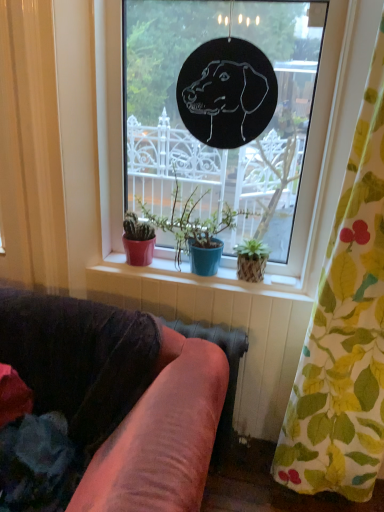
Question: Can you confirm if matte ceramic pots at center is shorter than floral fabric curtain at right?

Choices:
 (A) yes
 (B) no

Answer: (A)

Question: Is matte ceramic pots at center looking in the opposite direction of floral fabric curtain at right?

Choices:
 (A) no
 (B) yes

Answer: (A)

Question: Is matte ceramic pots at center completely or partially outside of floral fabric curtain at right?

Choices:
 (A) no
 (B) yes

Answer: (B)

Question: Considering the relative positions of matte ceramic pots at center and floral fabric curtain at right in the image provided, is matte ceramic pots at center to the right of floral fabric curtain at right from the viewer's perspective?

Choices:
 (A) no
 (B) yes

Answer: (A)

Question: Can you confirm if matte ceramic pots at center is taller than floral fabric curtain at right?

Choices:
 (A) no
 (B) yes

Answer: (A)

Question: Do you think matte ceramic pots at center is within black paper dog at center, or outside of it?

Choices:
 (A) outside
 (B) inside

Answer: (B)

Question: In terms of width, does matte ceramic pots at center look wider or thinner when compared to black paper dog at center?

Choices:
 (A) thin
 (B) wide

Answer: (A)

Question: Considering the positions of matte ceramic pots at center and black paper dog at center in the image, is matte ceramic pots at center bigger or smaller than black paper dog at center?

Choices:
 (A) big
 (B) small

Answer: (B)

Question: Is point (89, 286) closer or farther from the camera than point (334, 172)?

Choices:
 (A) closer
 (B) farther

Answer: (B)

Question: Considering the positions of matte ceramic pots at center and matte red pot at center in the image, is matte ceramic pots at center taller or shorter than matte red pot at center?

Choices:
 (A) tall
 (B) short

Answer: (B)

Question: Considering their positions, is matte ceramic pots at center located in front of or behind matte red pot at center?

Choices:
 (A) behind
 (B) front

Answer: (A)

Question: In terms of width, does matte ceramic pots at center look wider or thinner when compared to matte red pot at center?

Choices:
 (A) thin
 (B) wide

Answer: (A)

Question: From a real-world perspective, is matte ceramic pots at center positioned above or below matte red pot at center?

Choices:
 (A) below
 (B) above

Answer: (A)

Question: From a real-world perspective, is floral fabric curtain at right above or below matte ceramic pots at center?

Choices:
 (A) below
 (B) above

Answer: (B)

Question: Choose the correct answer: Is floral fabric curtain at right inside matte ceramic pots at center or outside it?

Choices:
 (A) inside
 (B) outside

Answer: (B)